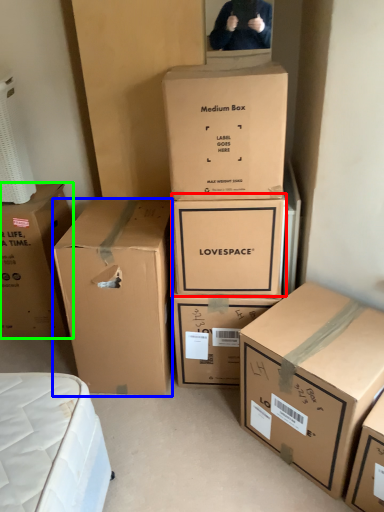
Question: Estimate the real-world distances between objects in this image. Which object is farther from box (highlighted by a red box), box (highlighted by a blue box) or box (highlighted by a green box)?

Choices:
 (A) box
 (B) box

Answer: (B)